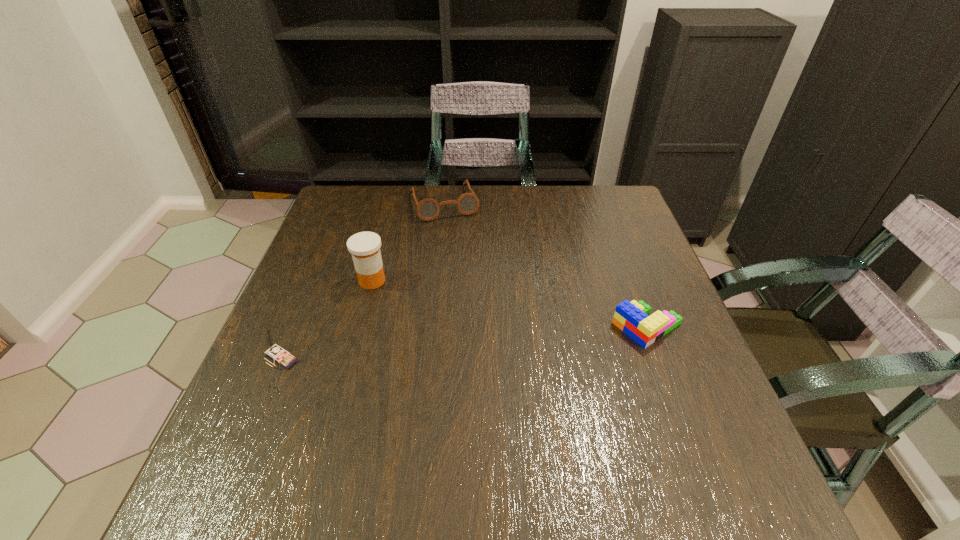
At what (x,y) coordinates should I click in order to perform the action: click on the leftmost object. Please return your answer as a coordinate pair (x, y). Image resolution: width=960 pixels, height=540 pixels. Looking at the image, I should click on (279, 355).

Image resolution: width=960 pixels, height=540 pixels. I want to click on Lego, so click(632, 318).

Identify the location of the rightmost object. (632, 318).

The width and height of the screenshot is (960, 540). What are the coordinates of `medicine` in the screenshot? It's located at (364, 246).

I want to click on the third object from right to left, so click(x=364, y=246).

What are the coordinates of `the third tallest object` in the screenshot? It's located at (427, 209).

Where is `spectacles`? The width and height of the screenshot is (960, 540). spectacles is located at coordinates (427, 209).

What are the coordinates of `free region located 0.280m on the right of the matchbox` in the screenshot? It's located at (436, 358).

Identify the location of blank space located 0.270m on the left of the rightmost object. The height and width of the screenshot is (540, 960). (491, 326).

The height and width of the screenshot is (540, 960). Identify the location of free space located 0.150m on the label of the medicine. (420, 321).